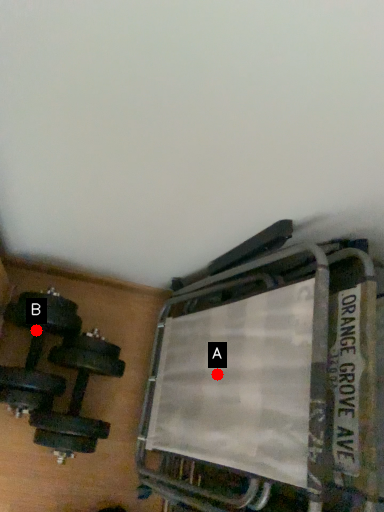
Question: Two points are circled on the image, labeled by A and B beside each circle. Among these points, which one is nearest to the camera?

Choices:
 (A) A is closer
 (B) B is closer

Answer: (A)